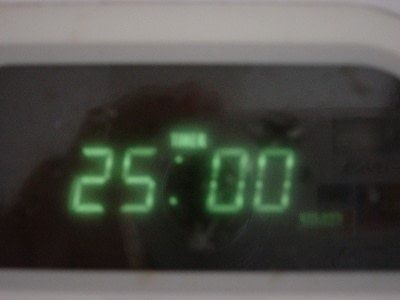
This screenshot has height=300, width=400. Identify the location of black clock face. (169, 100).